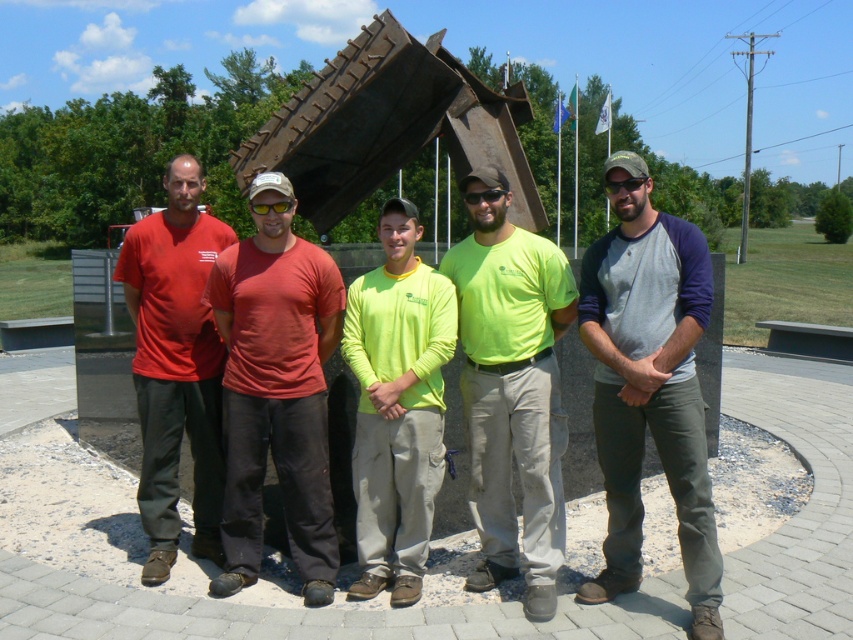
Who is positioned more to the right, matte red t-shirt at center or dark brown metal sculpture at center?

Positioned to the right is dark brown metal sculpture at center.

Which is more to the left, matte red t-shirt at center or dark brown metal sculpture at center?

From the viewer's perspective, matte red t-shirt at center appears more on the left side.

Is point (280, 173) positioned behind point (386, 24)?

No, (280, 173) is in front of (386, 24).

The height and width of the screenshot is (640, 853). I want to click on matte red t-shirt at center, so click(x=276, y=388).

Who is higher up, matte red t-shirt at center or neon yellow long-sleeve shirt at center?

matte red t-shirt at center is above.

Does matte red t-shirt at center have a lesser height compared to neon yellow long-sleeve shirt at center?

Incorrect, matte red t-shirt at center's height does not fall short of neon yellow long-sleeve shirt at center's.

Does point (236, 582) come behind point (364, 580)?

That is False.

Where is `matte red t-shirt at center`? matte red t-shirt at center is located at coordinates (276, 388).

Based on the photo, can you confirm if matte red t-shirt at center is shorter than neon green t-shirt at center?

Correct, matte red t-shirt at center is not as tall as neon green t-shirt at center.

In the scene shown: Can you confirm if matte red t-shirt at center is smaller than neon green t-shirt at center?

Yes.

Is point (323, 451) farther from viewer compared to point (463, 289)?

Yes, point (323, 451) is behind point (463, 289).

Identify the location of matte red t-shirt at center. Image resolution: width=853 pixels, height=640 pixels. click(276, 388).